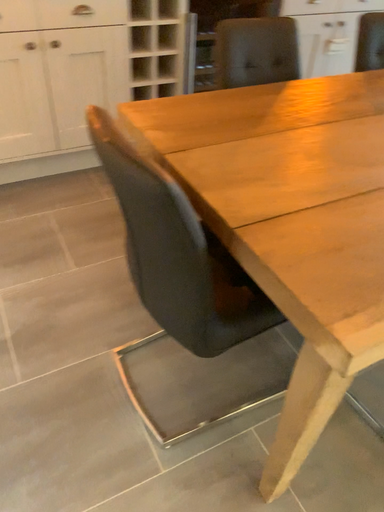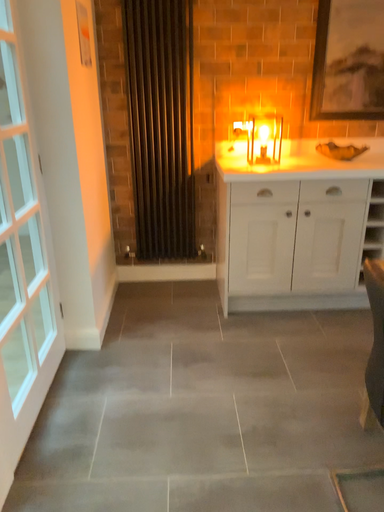
Question: Which way did the camera rotate in the video?

Choices:
 (A) rotated upward
 (B) rotated downward

Answer: (A)